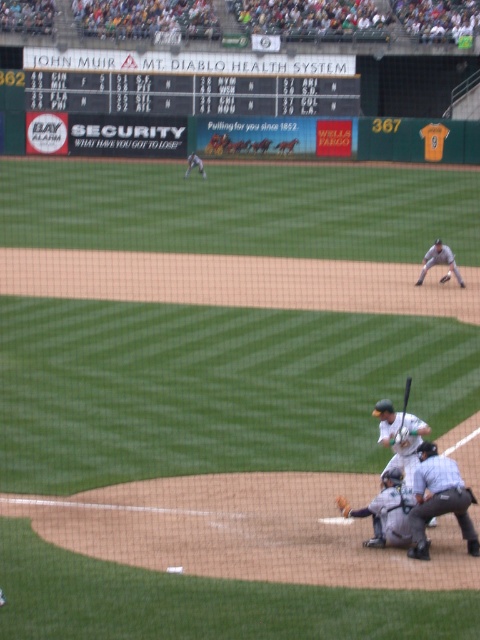
Question: Among these objects, which one is farthest from the camera?

Choices:
 (A) dark gray uniform at center
 (B) brown leather glove at lower center

Answer: (A)

Question: Is white matte baseball bat at lower center below dark brown leather glove at lower center?

Choices:
 (A) yes
 (B) no

Answer: (B)

Question: Does dark gray uniform at center have a lesser width compared to brown leather glove at lower center?

Choices:
 (A) no
 (B) yes

Answer: (B)

Question: Among these objects, which one is farthest from the camera?

Choices:
 (A) dark gray uniform at center
 (B) gray matte catcher at lower center
 (C) gray uniformed umpire at lower right
 (D) wooden bat at lower center

Answer: (A)

Question: Based on their relative distances, which object is nearer to the wooden bat at lower center?

Choices:
 (A) gray uniformed umpire at lower right
 (B) white matte baseball bat at lower center
 (C) dark gray uniform at center

Answer: (B)

Question: Is gray uniformed umpire at lower right to the right of white matte baseball bat at lower center from the viewer's perspective?

Choices:
 (A) no
 (B) yes

Answer: (B)